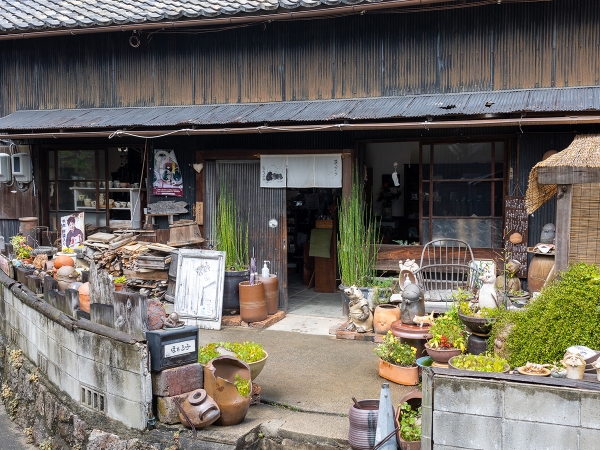
Identify the location of handle. (283, 245).